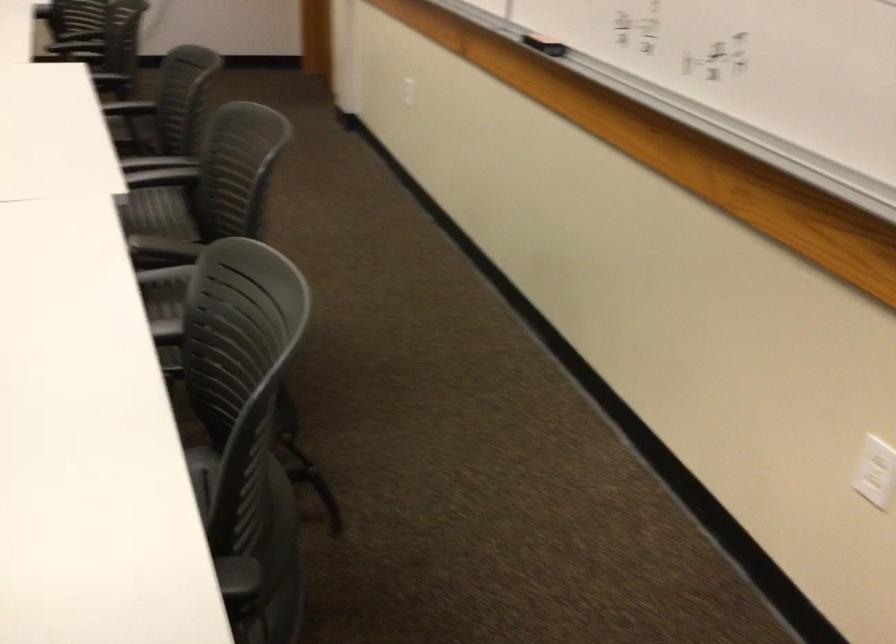
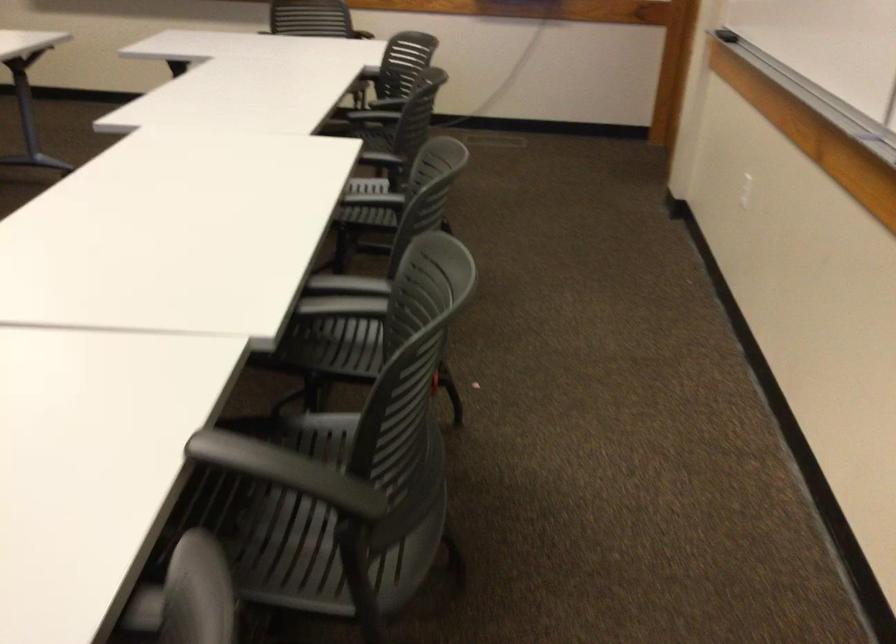
Question: In a continuous first-person perspective shot, in which direction is the camera moving?

Choices:
 (A) Left
 (B) Right
 (C) Forward
 (D) Backward

Answer: (C)